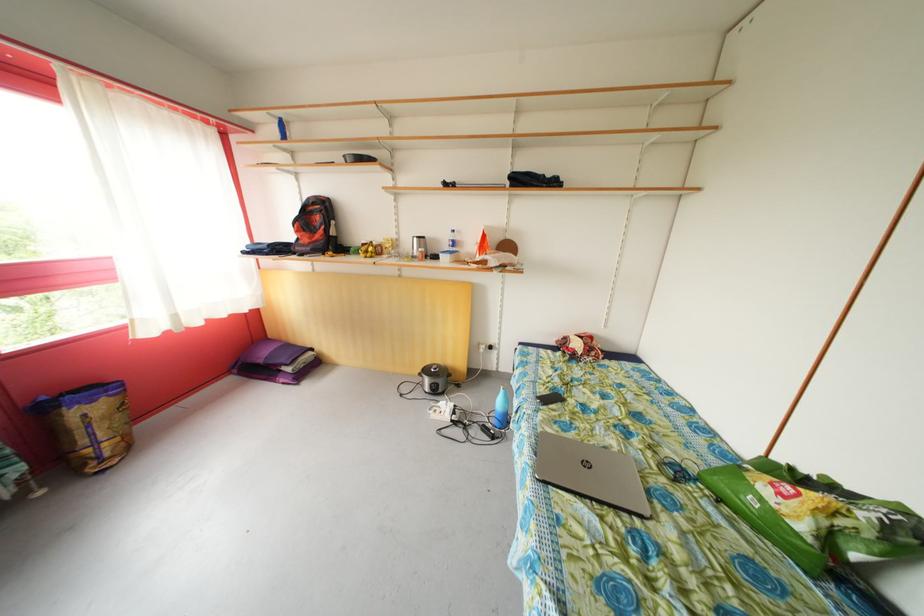
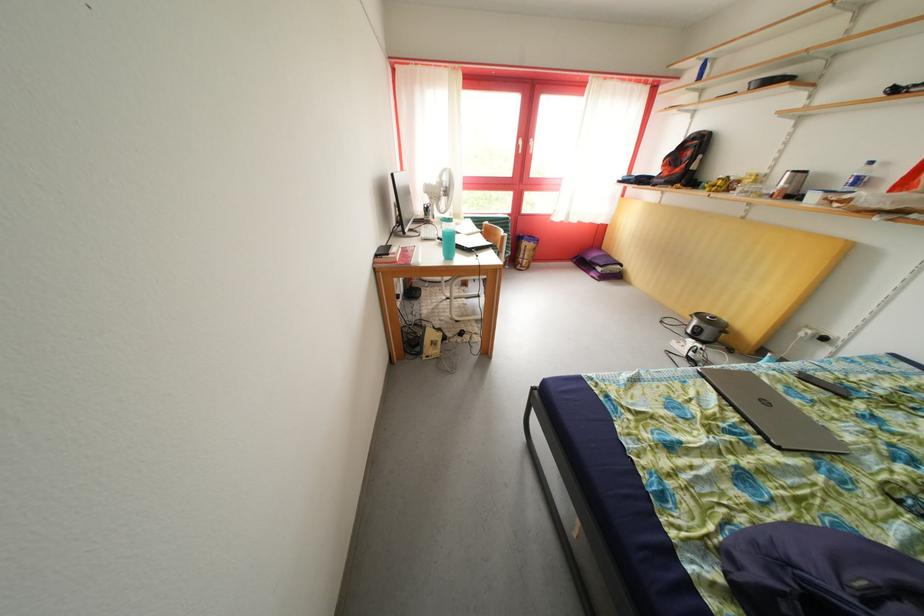
The point at (x=312, y=217) is marked in the first image. Where is the corresponding point in the second image?

(689, 153)